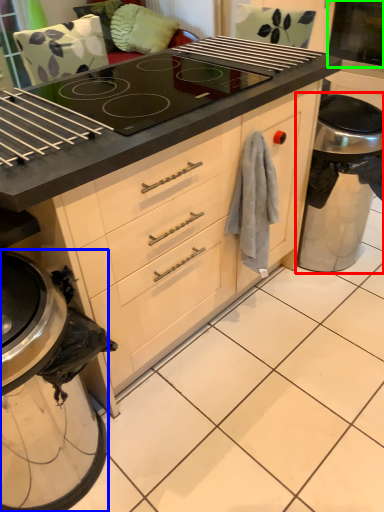
Question: Considering the real-world distances, which object is farthest from appliance (highlighted by a red box)? kitchen appliance (highlighted by a blue box) or screen door (highlighted by a green box)?

Choices:
 (A) kitchen appliance
 (B) screen door

Answer: (A)